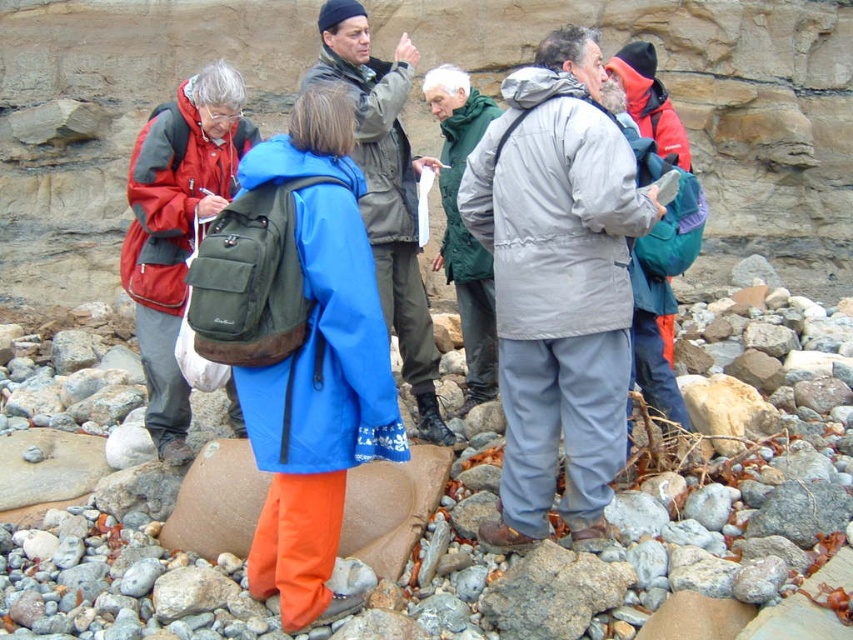
You are a hiker planning to carry both the matte black backpack at left and the matte gray jacket at center. Based on their sizes, which item can you place on top of the other?

The matte black backpack at left is shorter than the matte gray jacket at center, so the backpack can be placed on top of the jacket.

You are part of the group standing near the rocky shoreline. You need to hand a geological sample to the person wearing the matte gray jacket at center. Which direction should you move to reach them from the matte black backpack at left?

Result: The matte black backpack at left is below the matte gray jacket at center, so you should move upward to reach the person wearing the matte gray jacket at center from the backpack.